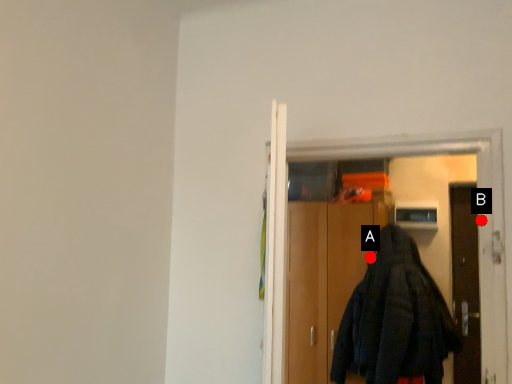
Question: Two points are circled on the image, labeled by A and B beside each circle. Which of the following is the farthest from the observer?

Choices:
 (A) A is further
 (B) B is further

Answer: (A)